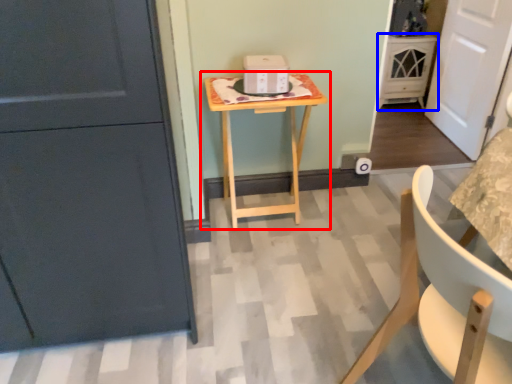
Question: Which object appears closest to the camera in this image, table (highlighted by a red box) or cabinetry (highlighted by a blue box)?

Choices:
 (A) table
 (B) cabinetry

Answer: (A)